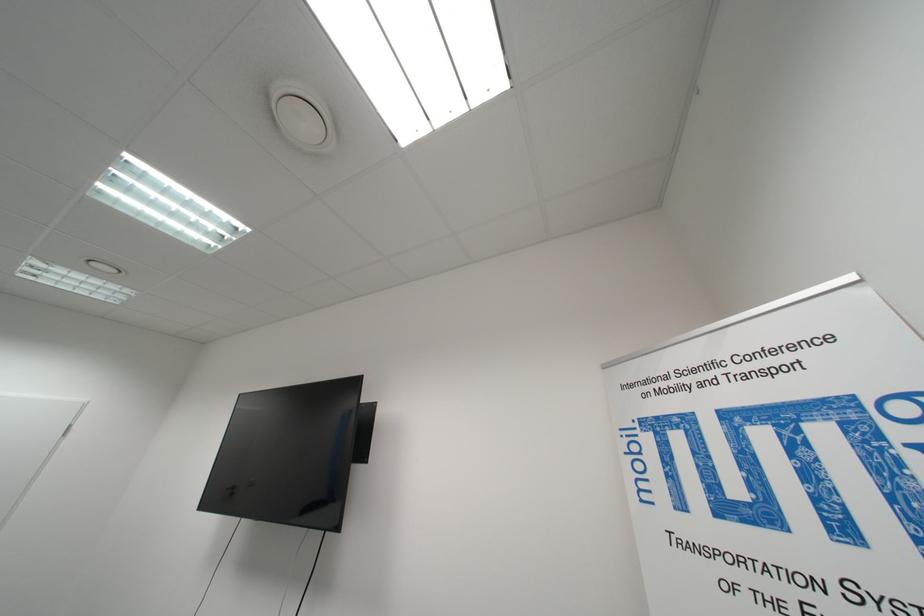
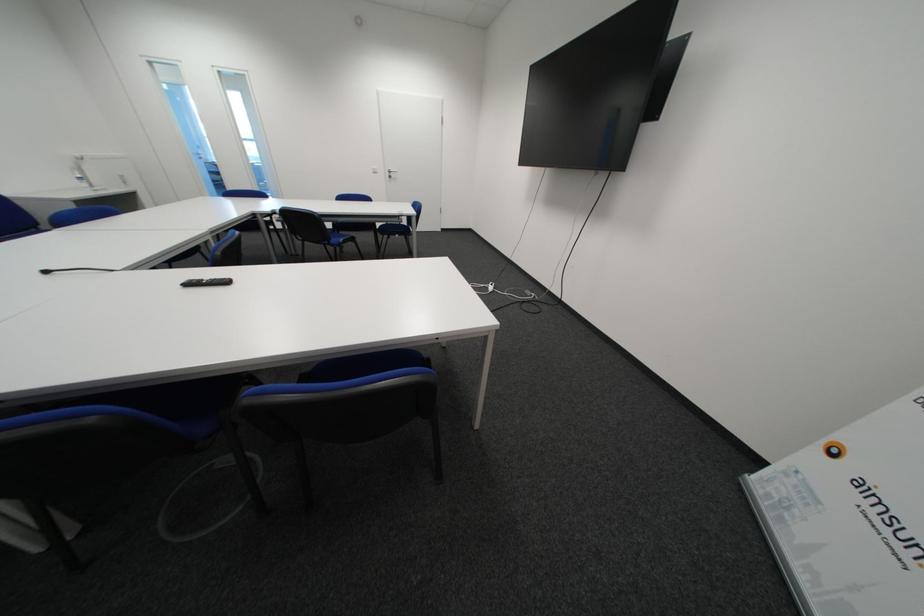
How did the camera likely rotate?

The rotation direction of the camera is left-down.